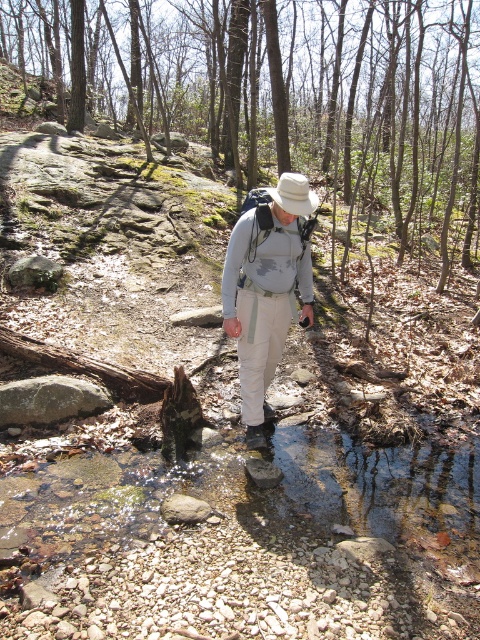
You are a hiker who needs to know if you can safely place a 36 inch long hiking stick between the matte gray shirt at center and the white fabric hat at center. Can you fit the stick horizontally between them?

The distance between the matte gray shirt at center and the white fabric hat at center is 36.61 inches. Since the hiking stick is 36 inches long, it can fit horizontally between them as there is enough space.